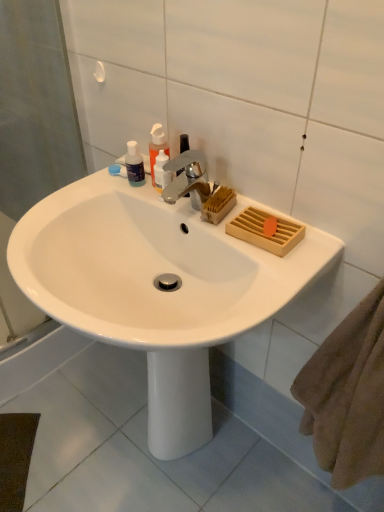
You are a GUI agent. You are given a task and a screenshot of the screen. Output one action in this format:
    pyautogui.click(x=<x>, y=<y>)
    Task: Click on the free space to the left of translucent plastic bottle at upper left, the 1th toiletry viewed from the left
    This screenshot has width=384, height=512.
    Given the screenshot: What is the action you would take?
    pyautogui.click(x=81, y=192)